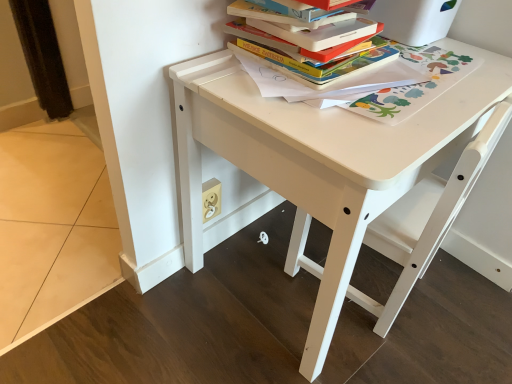
Locate an element on the screen. The width and height of the screenshot is (512, 384). vacant space in front of white matte chair at center is located at coordinates (393, 359).